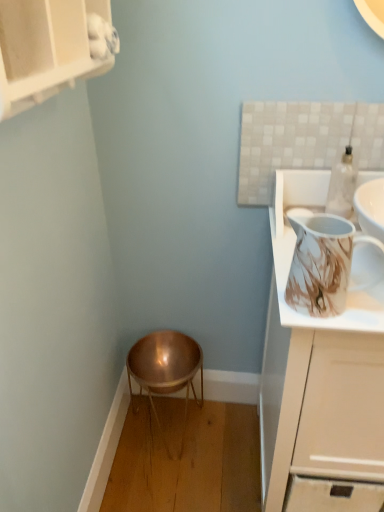
Question: From the image's perspective, is marble-patterned pitcher at upper right beneath white glossy cabinet at upper right, arranged as the 2th cabinetry when viewed from the top?

Choices:
 (A) yes
 (B) no

Answer: (B)

Question: From a real-world perspective, is marble-patterned pitcher at upper right physically below white glossy cabinet at upper right, arranged as the 2th cabinetry when viewed from the top?

Choices:
 (A) no
 (B) yes

Answer: (A)

Question: Can you confirm if marble-patterned pitcher at upper right is smaller than white glossy cabinet at upper right, arranged as the 2th cabinetry when viewed from the top?

Choices:
 (A) yes
 (B) no

Answer: (A)

Question: Considering the relative sizes of marble-patterned pitcher at upper right and white glossy cabinet at upper right, placed as the second cabinetry when sorted from left to right, in the image provided, is marble-patterned pitcher at upper right bigger than white glossy cabinet at upper right, placed as the second cabinetry when sorted from left to right,?

Choices:
 (A) no
 (B) yes

Answer: (A)

Question: From a real-world perspective, does marble-patterned pitcher at upper right stand above white glossy cabinet at upper right, the first cabinetry in the bottom-to-top sequence?

Choices:
 (A) no
 (B) yes

Answer: (B)

Question: Is marble-patterned pitcher at upper right taller than white glossy cabinet at upper right, arranged as the 2th cabinetry when viewed from the top?

Choices:
 (A) no
 (B) yes

Answer: (A)

Question: Is white glossy cabinet at upper right, placed as the second cabinetry when sorted from left to right, further to camera compared to copper metallic stool at lower center?

Choices:
 (A) yes
 (B) no

Answer: (B)

Question: Is copper metallic stool at lower center a part of white glossy cabinet at upper right, which is the first cabinetry in right-to-left order?

Choices:
 (A) no
 (B) yes

Answer: (A)

Question: Can you confirm if white glossy cabinet at upper right, which is the first cabinetry in right-to-left order, is taller than copper metallic stool at lower center?

Choices:
 (A) yes
 (B) no

Answer: (A)

Question: Is white glossy cabinet at upper right, placed as the second cabinetry when sorted from left to right, looking in the opposite direction of copper metallic stool at lower center?

Choices:
 (A) yes
 (B) no

Answer: (B)

Question: Is white glossy cabinet at upper right, arranged as the 2th cabinetry when viewed from the top, not within copper metallic stool at lower center?

Choices:
 (A) yes
 (B) no

Answer: (A)

Question: Can you confirm if white glossy cabinet at upper right, arranged as the 2th cabinetry when viewed from the top, is positioned to the right of copper metallic stool at lower center?

Choices:
 (A) no
 (B) yes

Answer: (B)

Question: From a real-world perspective, is marble-patterned pitcher at upper right located beneath copper metallic stool at lower center?

Choices:
 (A) no
 (B) yes

Answer: (A)